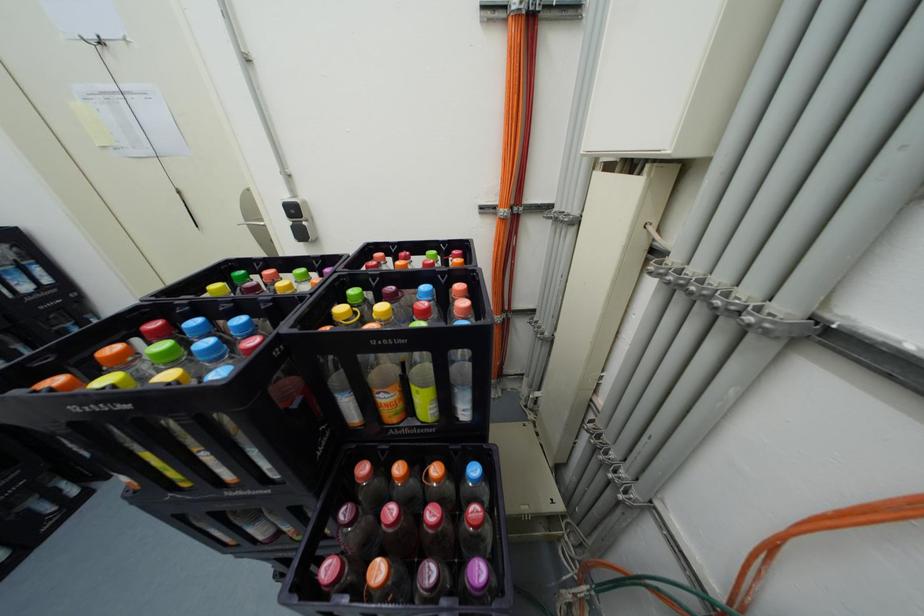
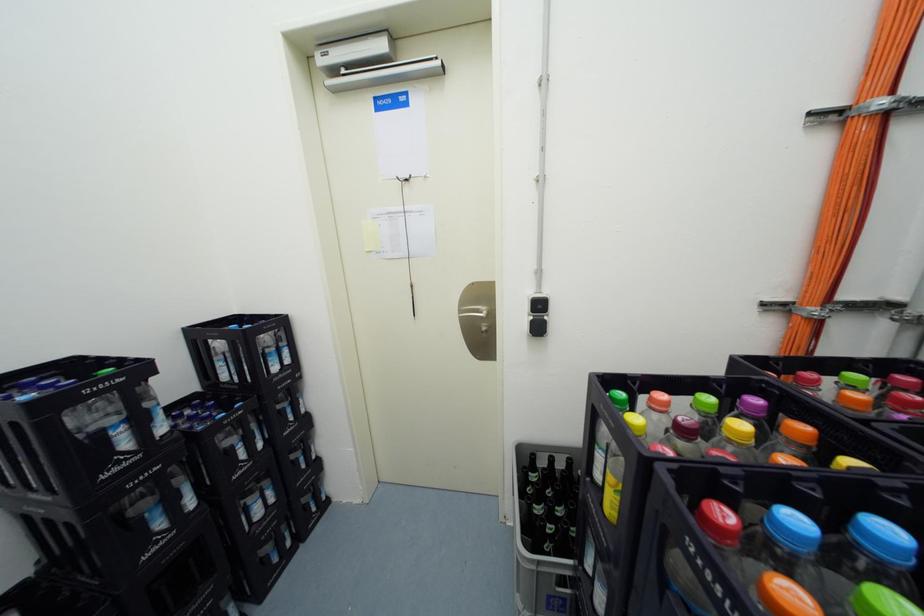
Question: The first image is from the beginning of the video and the second image is from the end. How did the camera likely rotate when shooting the video?

Choices:
 (A) Left
 (B) Right
 (C) Up
 (D) Down

Answer: (C)